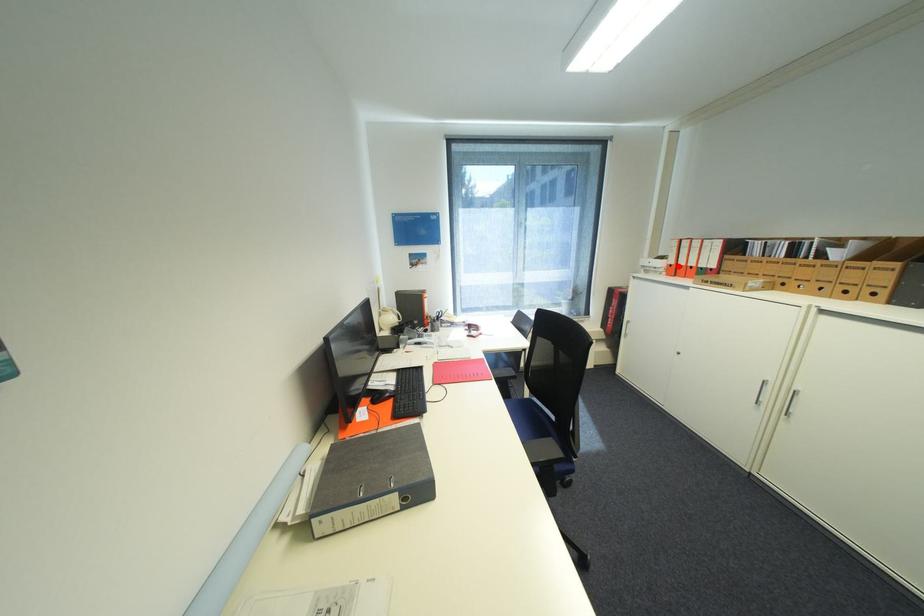
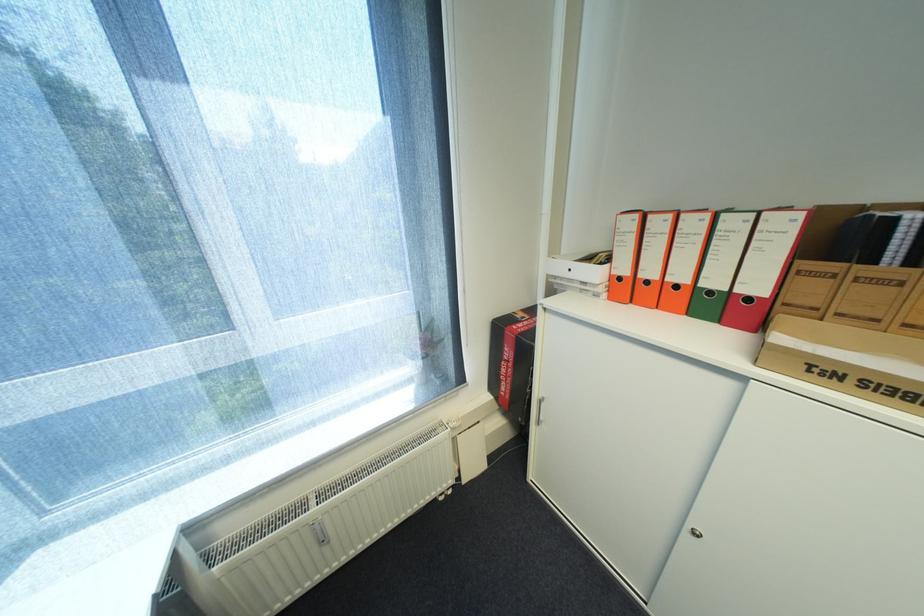
The point at the highlighted location is marked in the first image. Where is the corresponding point in the second image?

(627, 278)